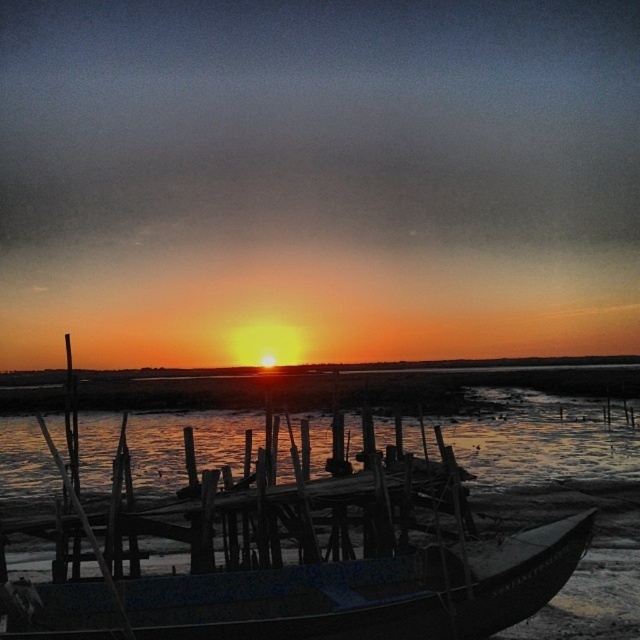
You are standing on the wooden at center of the dock and want to step into the translucent water at center. Based on the height difference between them, do you think you can step directly into the water without jumping?

The translucent water at center is much taller than the wooden at center, so stepping directly into the water might require a jump or careful step due to the height difference.

You are standing on the dock and want to place a 20 meter long floating walkway between the blue painted wood boat at lower center and the translucent water at center. Is this possible?

The blue painted wood boat at lower center and the translucent water at center are 19.78 meters apart from each other. Since the walkway is 20 meters long, it would be slightly too long to fit between them. You might need to adjust the length or position to ensure it fits within the 19.78 meter distance.

You are planning to place a new bench on the dock. The bench requires a space wider than the wooden at center. Can the blue painted wood boat at lower center provide enough space for the bench?

The blue painted wood boat at lower center is wider than the wooden at center, so it can provide enough space for the bench.